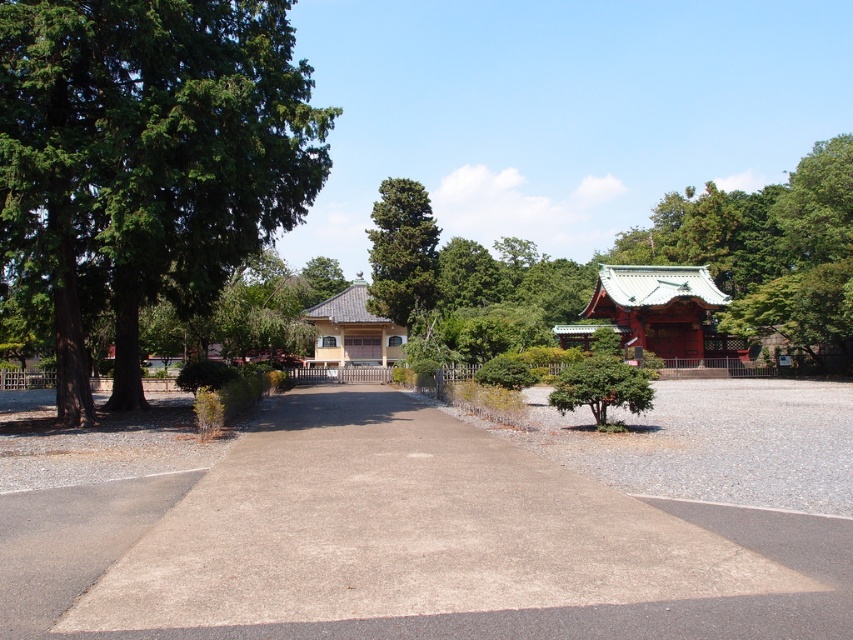
You are standing at the entrance of the garden and see the gray concrete driveway at center and the green textured tree at center. Which one is positioned to the right side?

The gray concrete driveway at center is positioned to the right of the green textured tree at center.

You are standing at the point marked by the coordinates point (x=405, y=544). Looking around, you see a yellow building with a sloped roof on the left and a gray concrete driveway at center. Which direction should you walk to reach the yellow building with a sloped roof?

You should walk to the left because the yellow building with a sloped roof is located to the left of the point (x=405, y=544).